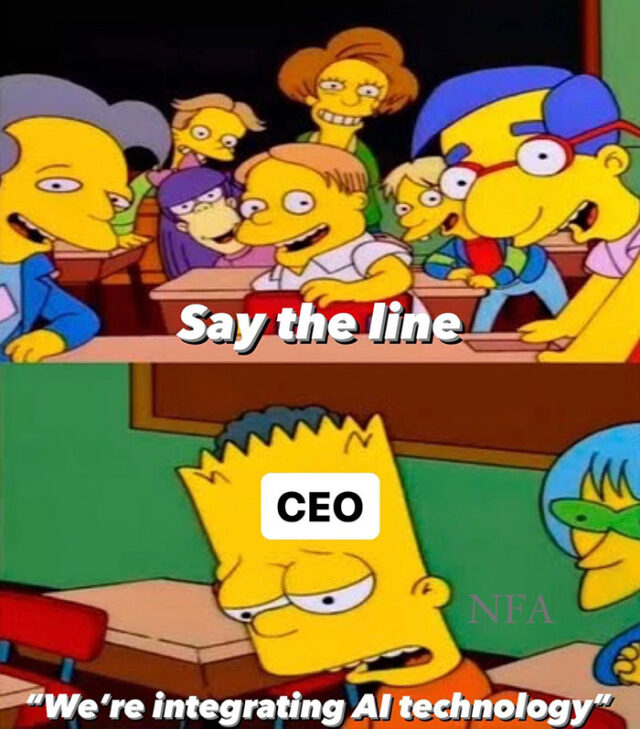
At what (x,y) coordinates should I click in order to perform the action: click on desks. Please return your answer as a coordinate pair (x, y). This screenshot has height=729, width=640. Looking at the image, I should click on (195, 289), (76, 267), (564, 245), (330, 354), (569, 670), (131, 633), (6, 687).